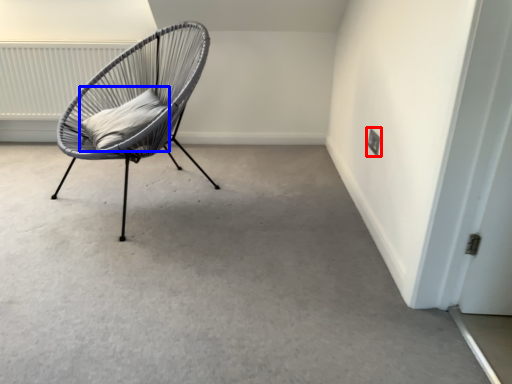
Question: Which of the following is the closest to the observer, electric outlet (highlighted by a red box) or pillow (highlighted by a blue box)?

Choices:
 (A) electric outlet
 (B) pillow

Answer: (B)